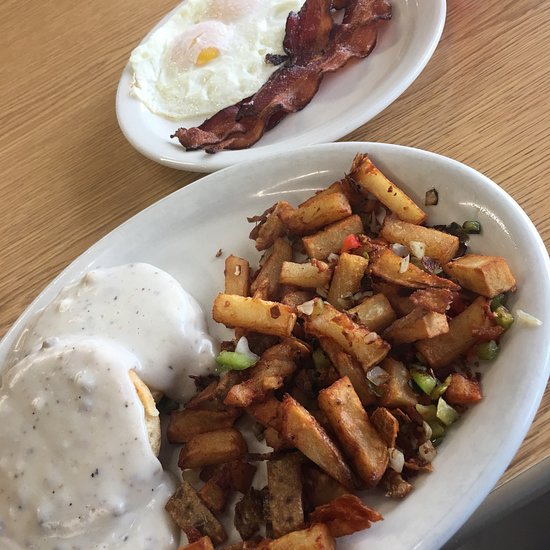
What are the coordinates of `table` in the screenshot? It's located at (35, 156).